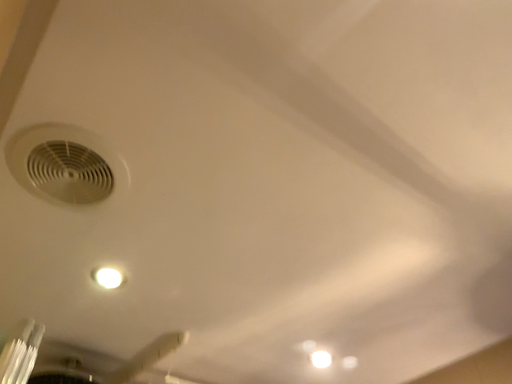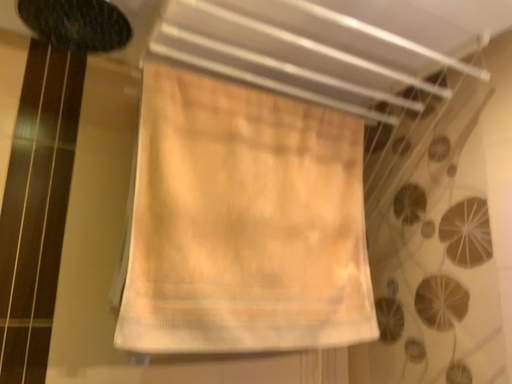
Question: How did the camera likely rotate when shooting the video?

Choices:
 (A) rotated right
 (B) rotated left

Answer: (B)